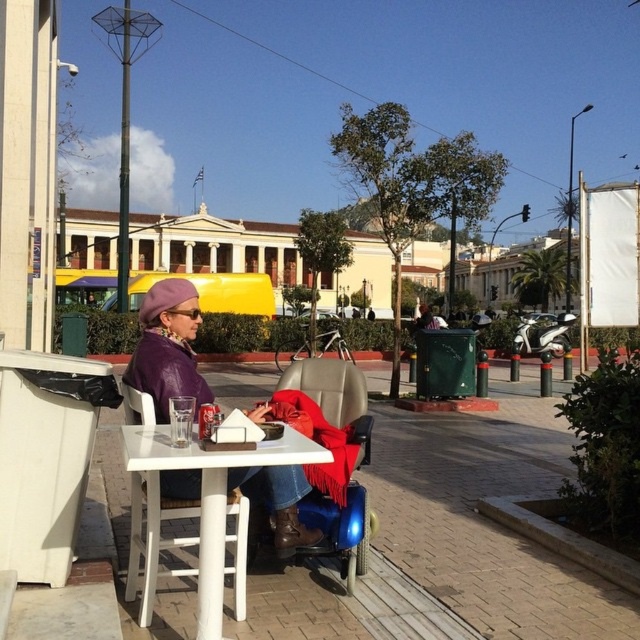
Question: Is purple leather jacket at center further to camera compared to white plastic table at center?

Choices:
 (A) yes
 (B) no

Answer: (A)

Question: Which of the following is the closest to the observer?

Choices:
 (A) (170, 477)
 (B) (221, 596)

Answer: (B)

Question: Is purple leather jacket at center thinner than white plastic table at center?

Choices:
 (A) yes
 (B) no

Answer: (A)

Question: Is purple leather jacket at center wider than white plastic table at center?

Choices:
 (A) no
 (B) yes

Answer: (A)

Question: Which point is closer to the camera?

Choices:
 (A) (275, 476)
 (B) (157, 472)

Answer: (B)

Question: Which point is closer to the camera taking this photo?

Choices:
 (A) (154, 524)
 (B) (144, 308)

Answer: (A)